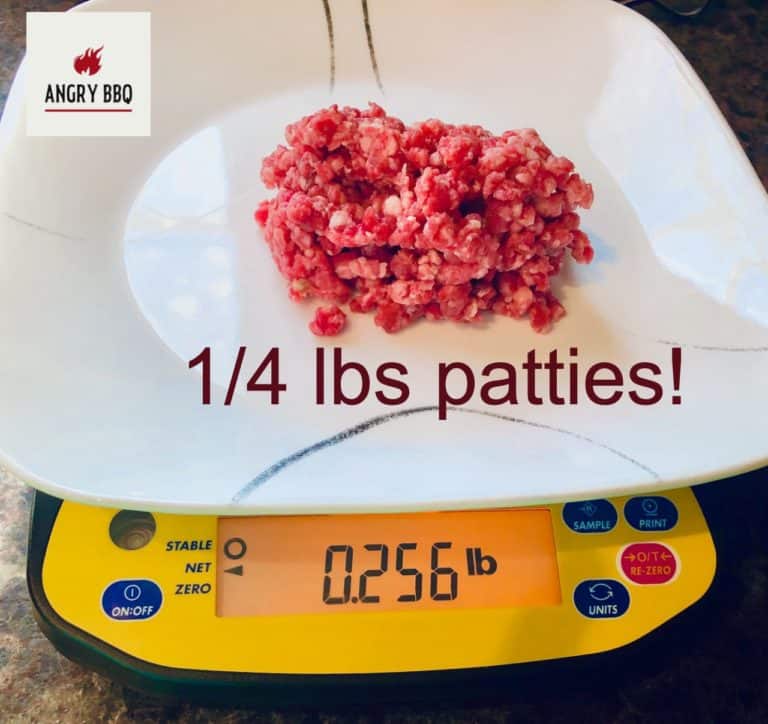
Locate an element on the screen. The height and width of the screenshot is (724, 768). yellow digital food scale is located at coordinates (266, 670), (492, 641).